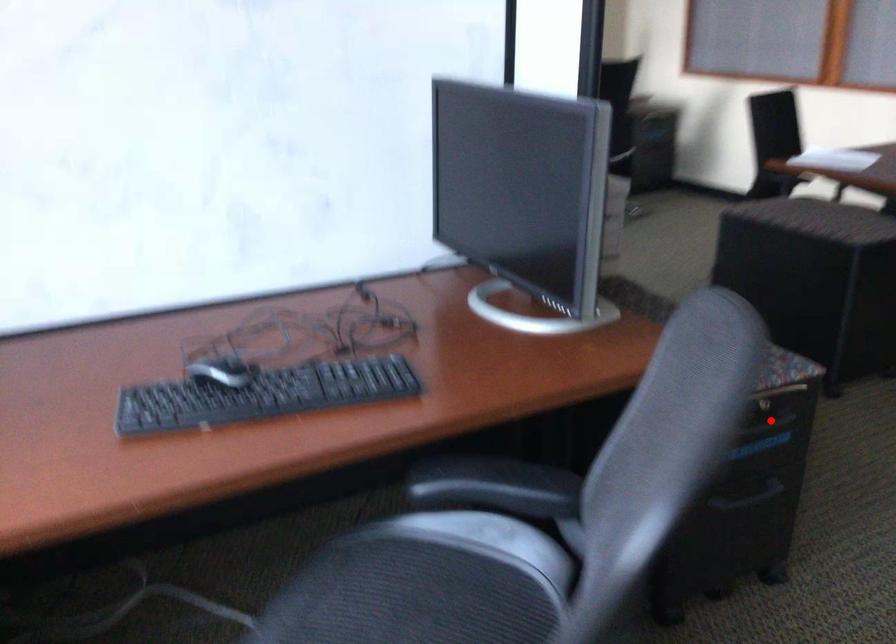
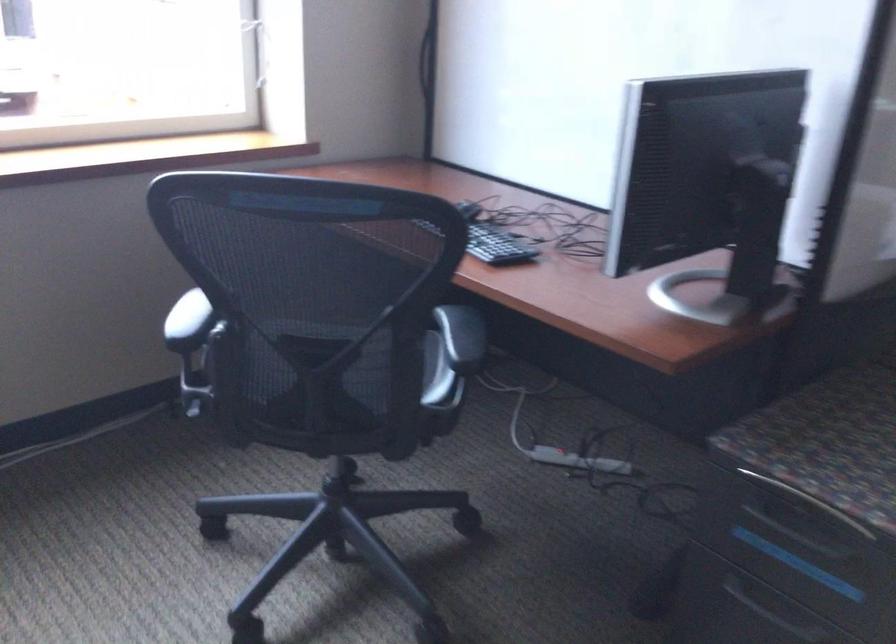
Locate, in the second image, the point that corresponds to the highlighted location in the first image.

(800, 536)